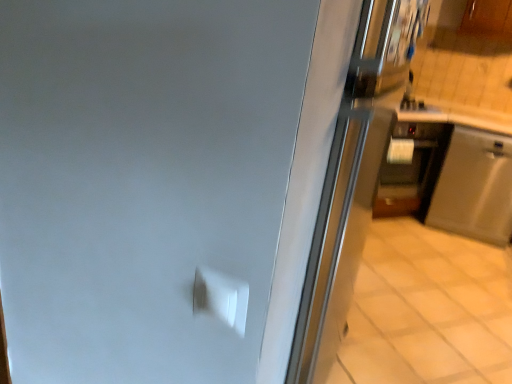
Describe the element at coordinates (474, 187) in the screenshot. I see `satin silver dishwasher at lower right` at that location.

You are a GUI agent. You are given a task and a screenshot of the screen. Output one action in this format:
    pyautogui.click(x=<x>, y=<y>)
    Task: Click on the satin silver dishwasher at lower right
    This screenshot has height=384, width=512.
    Given the screenshot: What is the action you would take?
    pyautogui.click(x=474, y=187)

Identify the location of satin silver dishwasher at lower right. (474, 187).